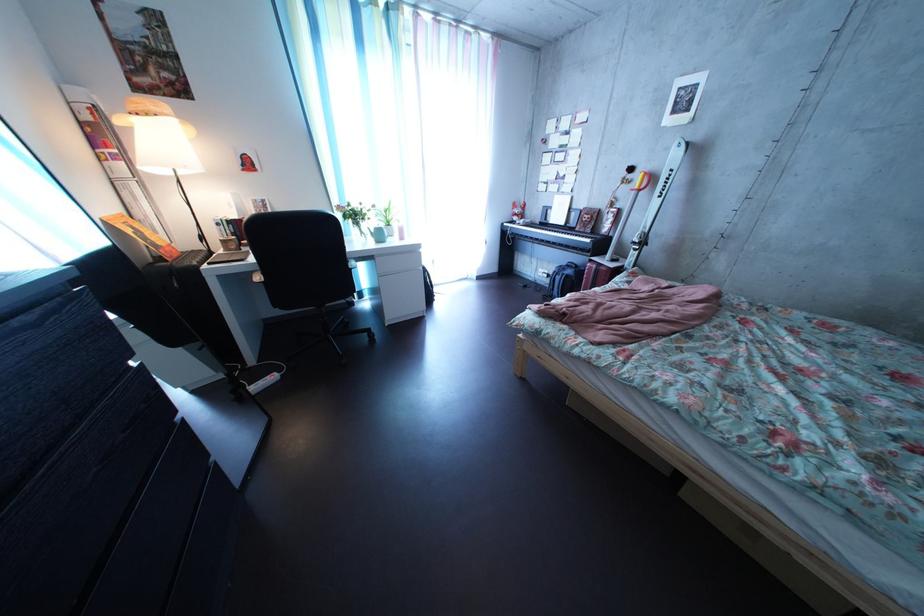
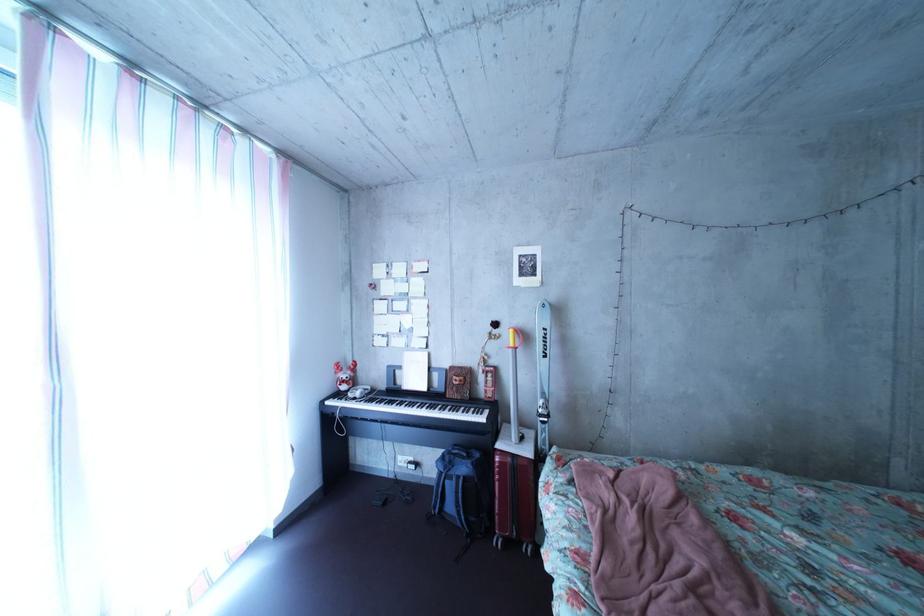
Locate, in the second image, the point that corresponds to point (584, 280) in the first image.

(479, 477)